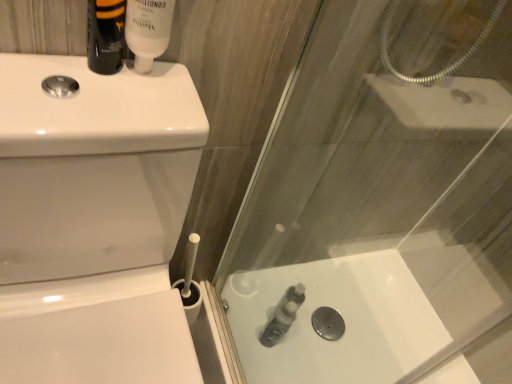
Where is `space that is in front of matte black bottle at upper left, the first toiletry viewed from the left`? This screenshot has height=384, width=512. space that is in front of matte black bottle at upper left, the first toiletry viewed from the left is located at coordinates (66, 92).